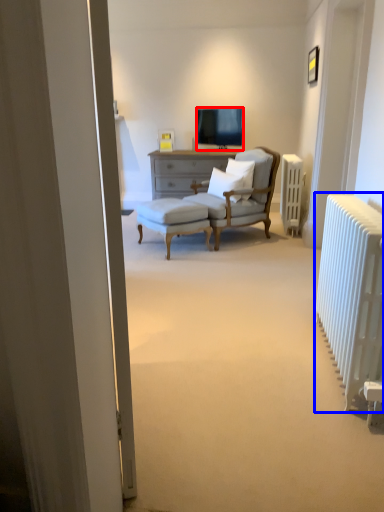
Question: Which of the following is the closest to the observer, television (highlighted by a red box) or radiator (highlighted by a blue box)?

Choices:
 (A) television
 (B) radiator

Answer: (B)